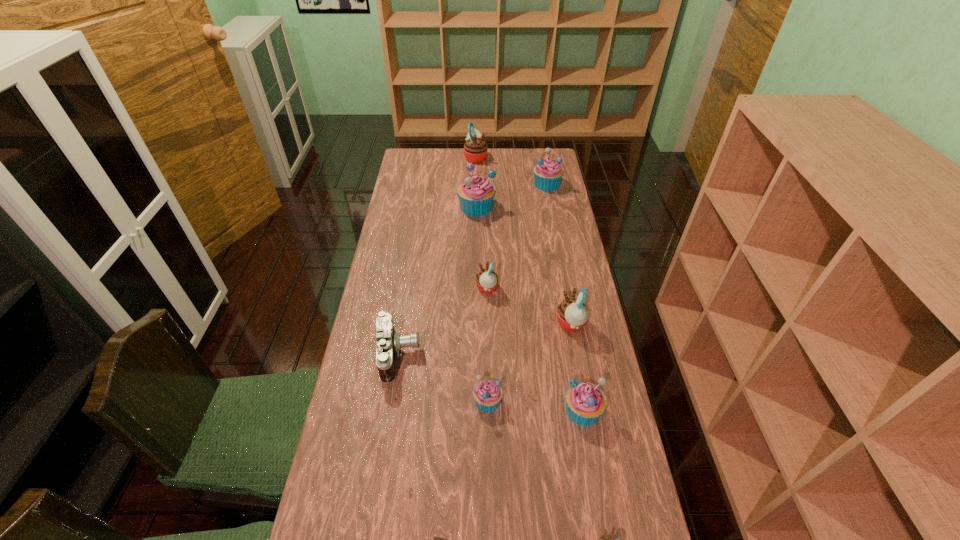
The image size is (960, 540). Identify the location of muffin that is the fifth nearest to the farthest object. (487, 394).

You are a GUI agent. You are given a task and a screenshot of the screen. Output one action in this format:
    pyautogui.click(x=<x>, y=<y>)
    Task: Click on the pink muffin that stands as the closest to the second smallest pink muffin
    The height and width of the screenshot is (540, 960).
    Given the screenshot: What is the action you would take?
    pyautogui.click(x=572, y=315)

Identify the location of pink muffin that is the fourth closest to the farthest blue muffin. (610, 538).

This screenshot has width=960, height=540. What are the coordinates of `blue muffin identified as the closest to the third farthest pink muffin` in the screenshot? It's located at (585, 402).

Locate which blue muffin ranks fourth in proximity to the farthest object. Please provide its 2D coordinates. Your answer should be formatted as a tuple, i.e. [(x, y)], where the tuple contains the x and y coordinates of a point satisfying the conditions above.

[(585, 402)]

The height and width of the screenshot is (540, 960). What are the coordinates of `free space that satisfies the following two spatial constraints: 1. on the front-facing side of the farthest pink muffin; 2. on the left side of the second biggest blue muffin` in the screenshot? It's located at (475, 184).

You are a GUI agent. You are given a task and a screenshot of the screen. Output one action in this format:
    pyautogui.click(x=<x>, y=<y>)
    Task: Click on the blank area in the image that satisfies the following two spatial constraints: 1. on the front side of the smallest blue muffin; 2. on the right side of the third farthest object
    
    Given the screenshot: What is the action you would take?
    pyautogui.click(x=474, y=401)

At what (x,y) coordinates should I click in order to perform the action: click on vacant space that satisfies the following two spatial constraints: 1. on the front side of the farthest blue muffin; 2. on the front-facing side of the second biggest pink muffin. Please return your answer as a coordinate pair (x, y). Looking at the image, I should click on (574, 324).

This screenshot has width=960, height=540. What are the coordinates of `vacant position in the image that satisfies the following two spatial constraints: 1. on the front side of the second farthest object; 2. on the front-facing side of the seventh nearest object` in the screenshot? It's located at pyautogui.click(x=566, y=288).